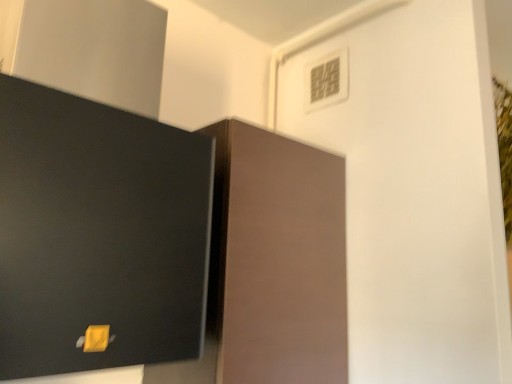
Question: From a real-world perspective, is matte brown cabinet at center physically located above or below white plastic light switch at upper center?

Choices:
 (A) below
 (B) above

Answer: (A)

Question: Looking at their shapes, would you say matte brown cabinet at center is wider or thinner than white plastic light switch at upper center?

Choices:
 (A) thin
 (B) wide

Answer: (B)

Question: In terms of height, does matte brown cabinet at center look taller or shorter compared to white plastic light switch at upper center?

Choices:
 (A) short
 (B) tall

Answer: (B)

Question: Considering the relative positions of white plastic light switch at upper center and matte brown cabinet at center in the image provided, is white plastic light switch at upper center to the left or to the right of matte brown cabinet at center?

Choices:
 (A) left
 (B) right

Answer: (B)

Question: Is white plastic light switch at upper center inside or outside of matte brown cabinet at center?

Choices:
 (A) inside
 (B) outside

Answer: (B)

Question: From their relative heights in the image, would you say white plastic light switch at upper center is taller or shorter than matte brown cabinet at center?

Choices:
 (A) short
 (B) tall

Answer: (A)

Question: In terms of width, does white plastic light switch at upper center look wider or thinner when compared to matte brown cabinet at center?

Choices:
 (A) wide
 (B) thin

Answer: (B)